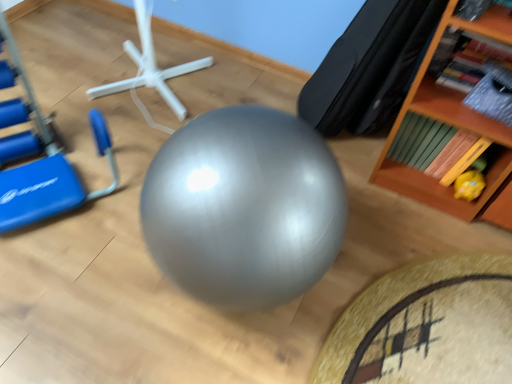
Image resolution: width=512 pixels, height=384 pixels. Identify the location of free space between blue plastic swivel chair at left and white plastic stand at center. (90, 107).